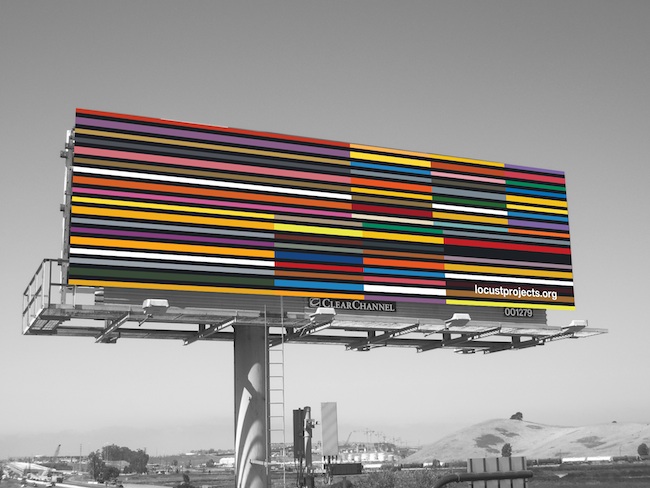
Image resolution: width=650 pixels, height=488 pixels. What are the coordinates of `metallic railing` in the screenshot? It's located at pyautogui.click(x=23, y=293), pyautogui.click(x=58, y=261).